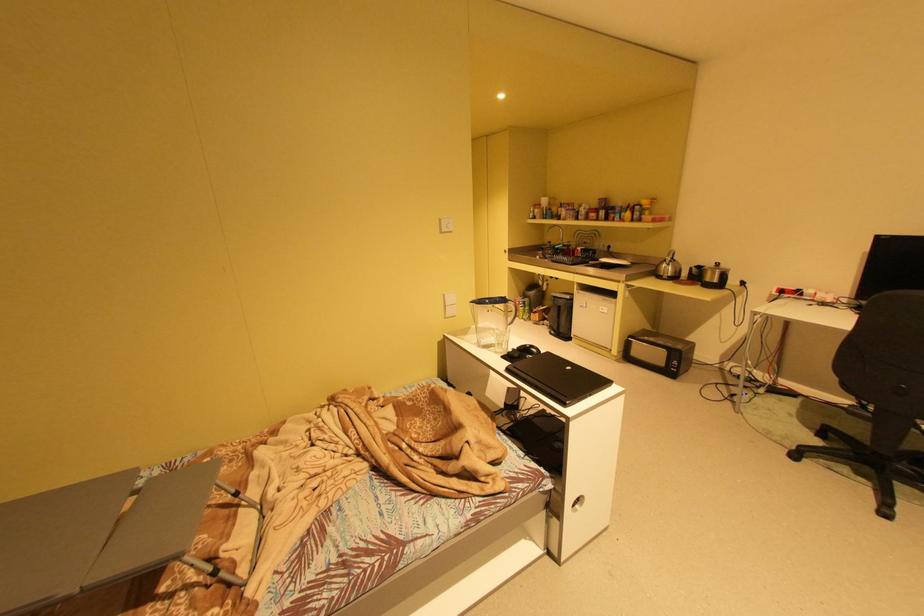
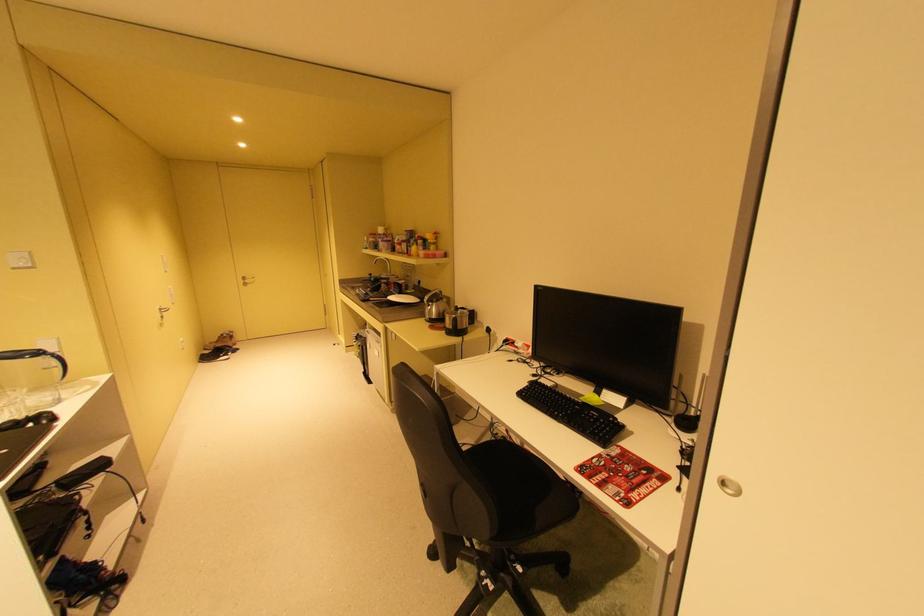
The point at (723, 282) is marked in the first image. Where is the corresponding point in the second image?

(460, 328)